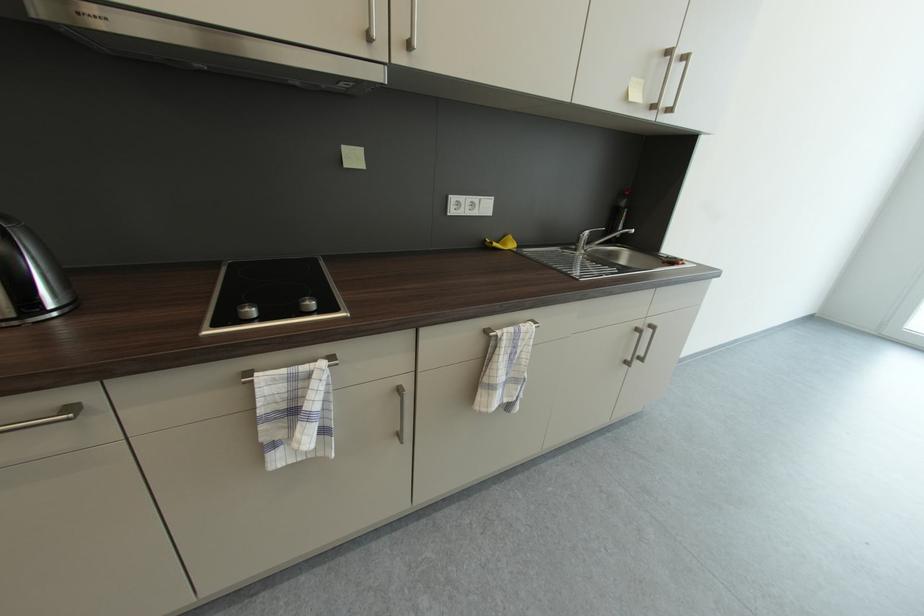
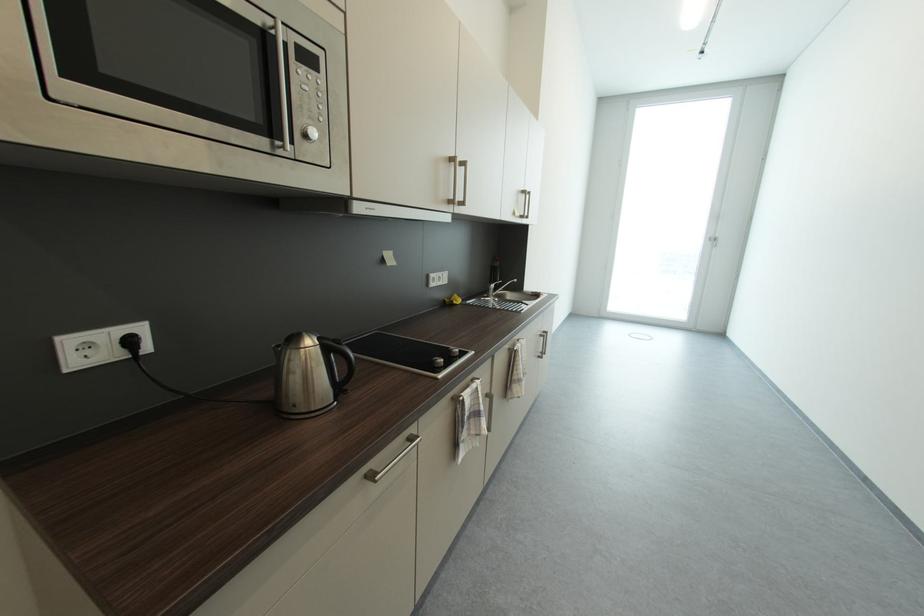
Locate, in the second image, the point that corresponds to (x=492, y=243) in the first image.

(453, 302)